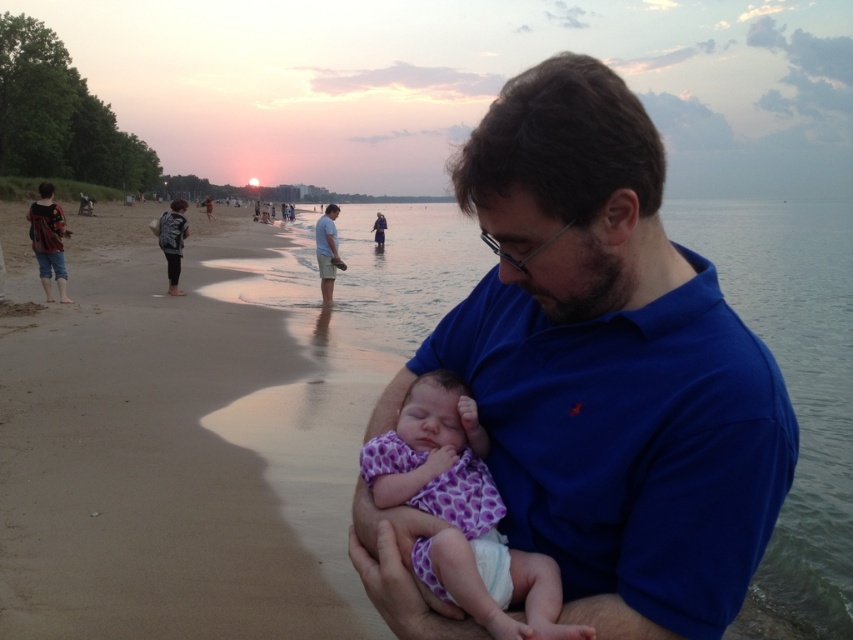
Question: Does purple fabric baby at center appear on the right side of light blue cotton shirt at center?

Choices:
 (A) no
 (B) yes

Answer: (B)

Question: Can you confirm if purple fabric baby at center is positioned above light blue cotton shirt at center?

Choices:
 (A) yes
 (B) no

Answer: (B)

Question: Which object is the closest to the blue cotton shirt at center?

Choices:
 (A) beige sand at center
 (B) purple fabric baby at center

Answer: (B)

Question: Which object is the farthest from the blue cotton shirt at center?

Choices:
 (A) light blue cotton shirt at center
 (B) purple fabric baby at center

Answer: (A)

Question: Is blue cotton shirt at center to the left of light blue cotton shirt at center from the viewer's perspective?

Choices:
 (A) yes
 (B) no

Answer: (B)

Question: Which object appears closest to the camera in this image?

Choices:
 (A) beige sand at center
 (B) purple fabric baby at center

Answer: (B)